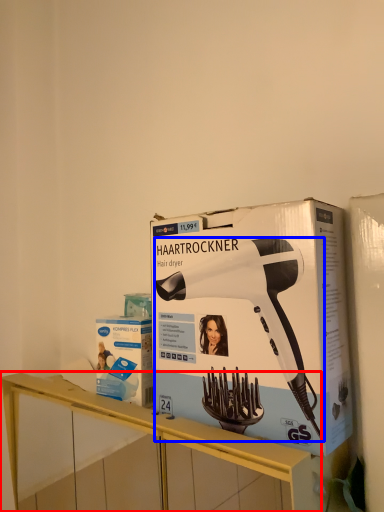
Question: Which point is further to the camera, furniture (highlighted by a red box) or hair drier (highlighted by a blue box)?

Choices:
 (A) furniture
 (B) hair drier

Answer: (B)